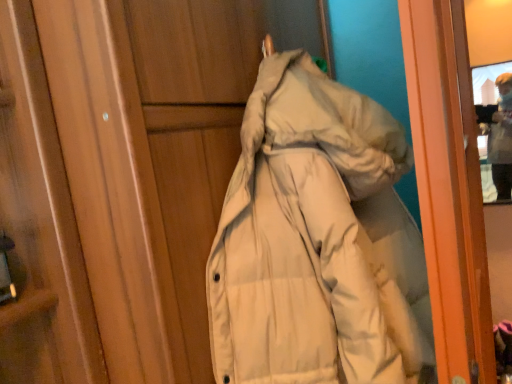
Find the location of `beige down jacket at upper center`. beige down jacket at upper center is located at coordinates (501, 139).

The height and width of the screenshot is (384, 512). What do you see at coordinates (501, 139) in the screenshot?
I see `beige down jacket at upper center` at bounding box center [501, 139].

Measure the distance between point (402, 353) and camera.

Point (402, 353) is 29.69 inches away from camera.

Describe the element at coordinates (311, 240) in the screenshot. This screenshot has height=384, width=512. I see `beige matte coat at center` at that location.

What is the approximate height of beige matte coat at center?

The height of beige matte coat at center is 37.59 inches.

What are the coordinates of `beige matte coat at center` in the screenshot? It's located at 311,240.

In order to face beige matte coat at center, should I rotate leftwards or rightwards?

To align with it, rotate right about 11.394°.

You are a GUI agent. You are given a task and a screenshot of the screen. Output one action in this format:
    pyautogui.click(x=<x>, y=<y>)
    Task: Click on the beige down jacket at upper center
    This screenshot has width=512, height=384.
    Given the screenshot: What is the action you would take?
    pyautogui.click(x=501, y=139)

Is beige matte coat at center at the right side of beige down jacket at upper center?

In fact, beige matte coat at center is to the left of beige down jacket at upper center.

Is the depth of beige matte coat at center greater than that of beige down jacket at upper center?

No, beige matte coat at center is closer to the viewer.

Which is in front, point (267, 172) or point (502, 174)?

The point (267, 172) is closer to the camera.

From the image's perspective, is beige matte coat at center on beige down jacket at upper center?

Actually, beige matte coat at center appears below beige down jacket at upper center in the image.

From a real-world perspective, is beige matte coat at center positioned above or below beige down jacket at upper center?

Clearly, from a real-world perspective, beige matte coat at center is below beige down jacket at upper center.

Looking at this image, which object is wider, beige matte coat at center or beige down jacket at upper center?

Wider between the two is beige matte coat at center.

Is beige matte coat at center shorter than beige down jacket at upper center?

Result: No.

Between beige matte coat at center and beige down jacket at upper center, which one has smaller size?

beige down jacket at upper center.

Would you say beige matte coat at center contains beige down jacket at upper center?

No, beige down jacket at upper center is not surrounded by beige matte coat at center.

Would you say beige matte coat at center is a long distance from beige down jacket at upper center?

Yes, beige matte coat at center and beige down jacket at upper center are located far from each other.

Could you tell me if beige matte coat at center is facing beige down jacket at upper center?

No, beige matte coat at center is not turned towards beige down jacket at upper center.

How different are the orientations of beige matte coat at center and beige down jacket at upper center in degrees?

87.3 degrees.

The width and height of the screenshot is (512, 384). Find the location of `individual lying on the right of beige matte coat at center`. individual lying on the right of beige matte coat at center is located at coordinates (501, 139).

Which is more to the left, beige down jacket at upper center or beige matte coat at center?

Positioned to the left is beige matte coat at center.

Considering their positions, is beige down jacket at upper center located in front of or behind beige matte coat at center?

beige down jacket at upper center is positioned farther from the viewer than beige matte coat at center.

Between point (501, 121) and point (353, 262), which one is positioned behind?

Positioned behind is point (501, 121).

Consider the image. From the image's perspective, is beige down jacket at upper center over beige matte coat at center?

Yes, from the image's perspective, beige down jacket at upper center is over beige matte coat at center.

From a real-world perspective, between beige down jacket at upper center and beige matte coat at center, who is vertically lower?

From a 3D spatial view, beige matte coat at center is below.

Is beige down jacket at upper center wider than beige matte coat at center?

No.

Between beige down jacket at upper center and beige matte coat at center, which one has less height?

beige down jacket at upper center is shorter.

Between beige down jacket at upper center and beige matte coat at center, which one has smaller size?

beige down jacket at upper center.

Would you say beige matte coat at center is part of beige down jacket at upper center's contents?

No, beige matte coat at center is not surrounded by beige down jacket at upper center.

Looking at this image, is beige down jacket at upper center directly adjacent to beige matte coat at center?

There is a gap between beige down jacket at upper center and beige matte coat at center.

Does beige down jacket at upper center turn towards beige matte coat at center?

No.

Measure the distance between beige down jacket at upper center and beige matte coat at center.

beige down jacket at upper center and beige matte coat at center are 5.76 feet apart from each other.

This screenshot has height=384, width=512. In order to click on individual that appears above the beige matte coat at center (from a real-world perspective) in this screenshot , I will do `click(501, 139)`.

Locate an element on the screen. coat on the left of beige down jacket at upper center is located at coordinates (311, 240).

Image resolution: width=512 pixels, height=384 pixels. I want to click on coat in front of the beige down jacket at upper center, so click(311, 240).